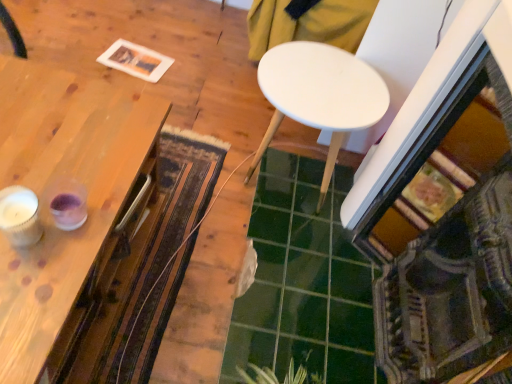
Image resolution: width=512 pixels, height=384 pixels. What are the coordinates of `free space in front of white textured candle at left` in the screenshot? It's located at (22, 294).